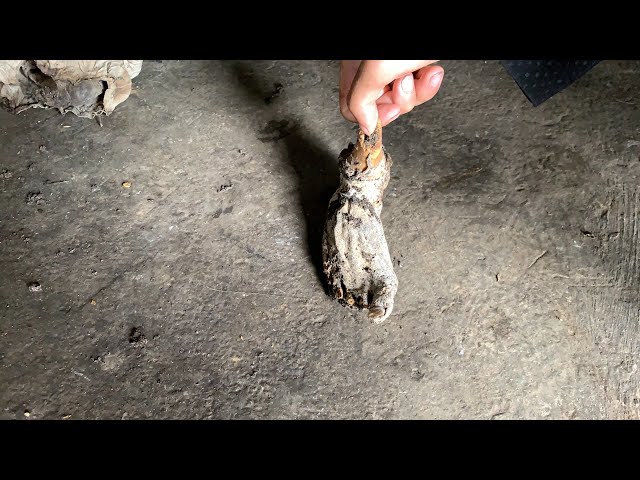
The image size is (640, 480). Find the location of `floor`. floor is located at coordinates (214, 307).